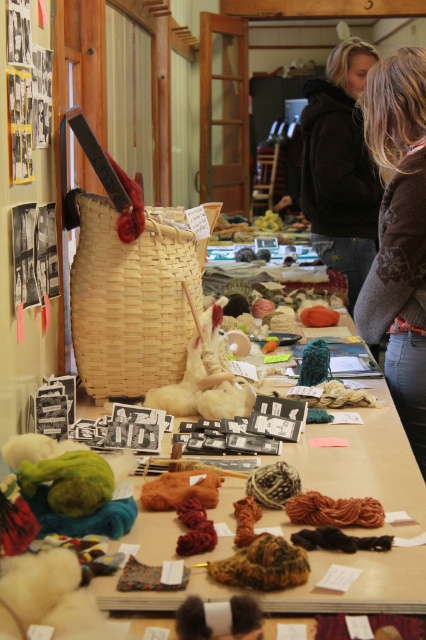
Question: Among these objects, which one is farthest from the camera?

Choices:
 (A) woven straw basket at center
 (B) woven basket at center

Answer: (A)

Question: Among these points, which one is nearest to the camera?

Choices:
 (A) (187, 278)
 (B) (379, 88)
 (C) (314, 563)

Answer: (C)

Question: Can you confirm if woven basket at center is positioned above woven straw basket at center?

Choices:
 (A) yes
 (B) no

Answer: (B)

Question: Among these points, which one is nearest to the camera?

Choices:
 (A) (365, 596)
 (B) (422, 122)
 (C) (334, 150)
 (D) (106, 240)

Answer: (A)

Question: Is brown fuzzy sweater at upper right bigger than black fuzzy jacket at upper center?

Choices:
 (A) no
 (B) yes

Answer: (A)

Question: Observing the image, what is the correct spatial positioning of woven basket at center in reference to woven straw basket at center?

Choices:
 (A) left
 (B) right

Answer: (B)